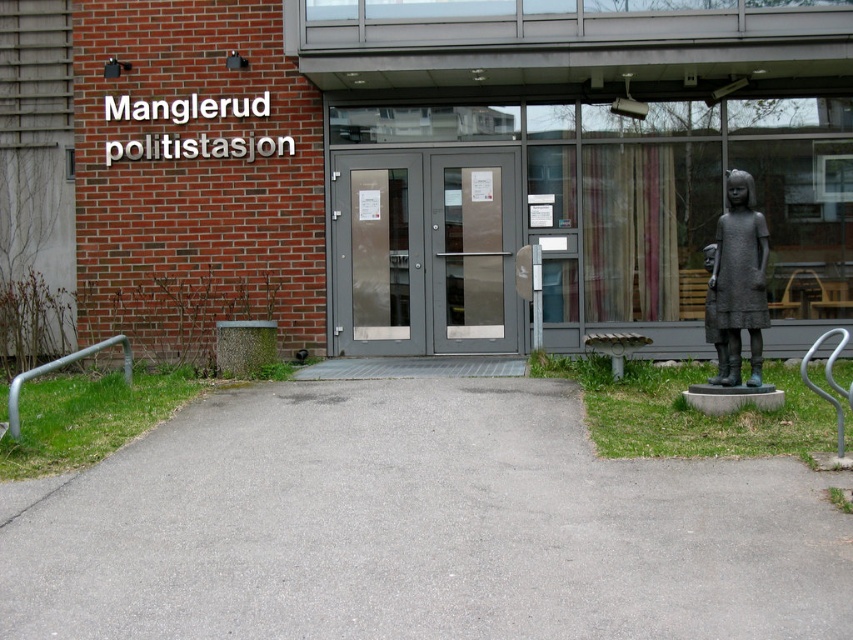
Can you confirm if matte gray doors at center is positioned to the left of bronze statue at right?

Indeed, matte gray doors at center is positioned on the left side of bronze statue at right.

Does matte gray doors at center have a lesser height compared to bronze statue at right?

No.

What do you see at coordinates (424, 252) in the screenshot? I see `matte gray doors at center` at bounding box center [424, 252].

The image size is (853, 640). I want to click on matte gray doors at center, so click(424, 252).